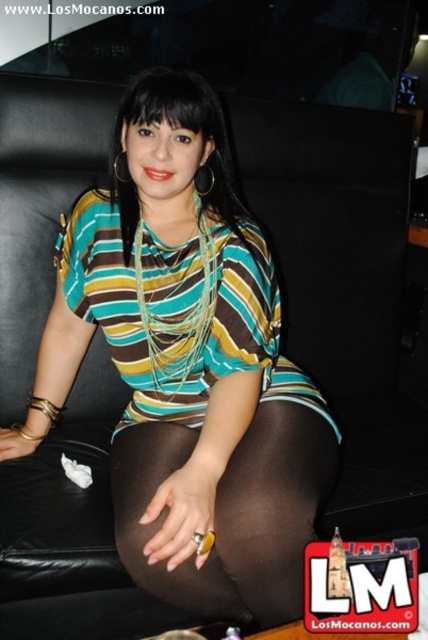
Which of these two, striped fabric shirt at center or brown sheer tights at center, stands shorter?

brown sheer tights at center

Does point (276, 532) lie behind point (297, 538)?

No.

I want to click on striped fabric shirt at center, so click(187, 365).